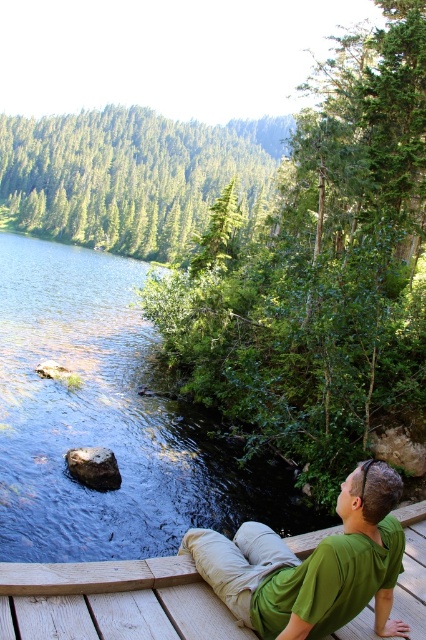
Question: Which point is farther to the camera?

Choices:
 (A) (313, 634)
 (B) (419, 556)
 (C) (236, 500)

Answer: (C)

Question: Which of these objects is positioned closest to the clear water at lower left?

Choices:
 (A) green matte shirt at lower right
 (B) wooden deck at lower center

Answer: (A)

Question: Where is clear water at lower left located in relation to green matte shirt at lower right in the image?

Choices:
 (A) left
 (B) right

Answer: (A)

Question: Where is clear water at lower left located in relation to wooden deck at lower center in the image?

Choices:
 (A) left
 (B) right

Answer: (A)

Question: Estimate the real-world distances between objects in this image. Which object is farther from the green matte shirt at lower right?

Choices:
 (A) wooden deck at lower center
 (B) clear water at lower left

Answer: (B)

Question: Does clear water at lower left come behind green matte shirt at lower right?

Choices:
 (A) no
 (B) yes

Answer: (B)